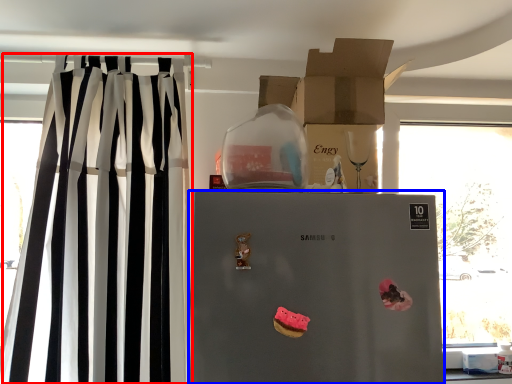
Question: Which point is closer to the camera, curtain (highlighted by a red box) or refrigerator (highlighted by a blue box)?

Choices:
 (A) curtain
 (B) refrigerator

Answer: (B)